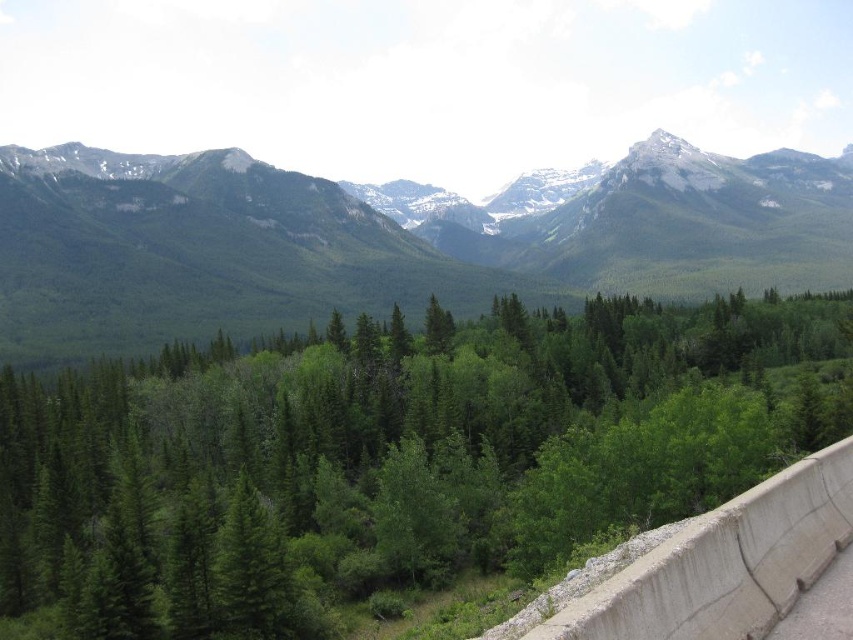
Who is more forward, (x=76, y=196) or (x=619, y=554)?

Positioned in front is point (x=619, y=554).

Does point (819, 256) lie behind point (787, 554)?

Yes, point (819, 256) is farther from viewer.

Locate an element on the screen. Image resolution: width=853 pixels, height=640 pixels. green forested mountain range at center is located at coordinates (380, 243).

Which is more to the right, green leafy trees at center or green forested mountain range at center?

green forested mountain range at center is more to the right.

How much distance is there between green leafy trees at center and green forested mountain range at center?

green leafy trees at center and green forested mountain range at center are 145.34 meters apart from each other.

Between point (846, 321) and point (722, 260), which one is positioned in front?

Positioned in front is point (846, 321).

Identify the location of green leafy trees at center. The width and height of the screenshot is (853, 640). (392, 458).

Who is more forward, (769,474) or (837,451)?

→ Point (837,451)

Image resolution: width=853 pixels, height=640 pixels. What do you see at coordinates (392, 458) in the screenshot? I see `green leafy trees at center` at bounding box center [392, 458].

Identify the location of green leafy trees at center. (392, 458).